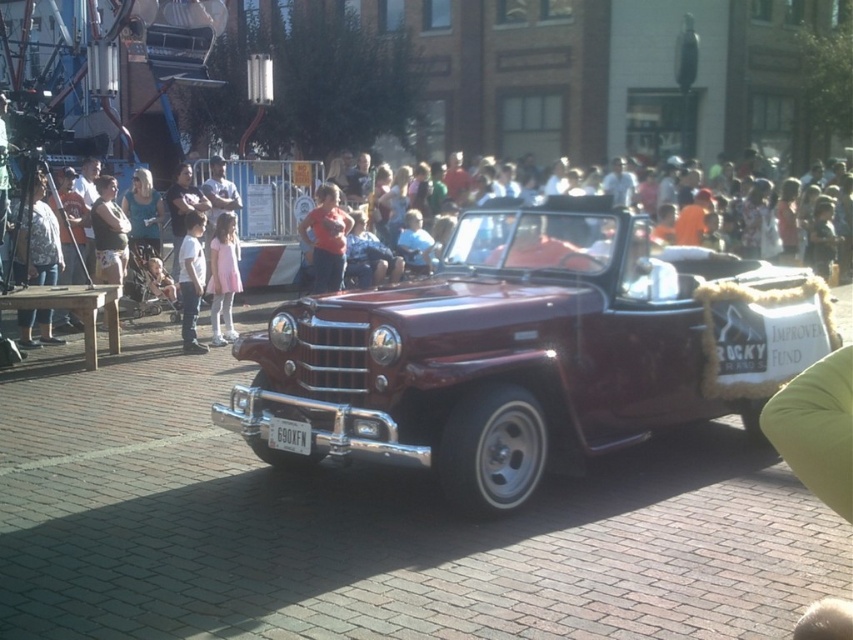
Question: Which point is closer to the camera?

Choices:
 (A) (254, 264)
 (B) (236, 333)

Answer: (B)

Question: Which object is positioned farthest from the white cotton shirt at left?

Choices:
 (A) pink satin dress at center
 (B) matte pink dress at left

Answer: (B)

Question: Among these objects, which one is farthest from the camera?

Choices:
 (A) pink satin dress at center
 (B) shiny maroon convertible at center
 (C) matte red shirt at center

Answer: (C)

Question: From the image, what is the correct spatial relationship of shiny maroon convertible at center in relation to white cotton shirt at left?

Choices:
 (A) left
 (B) right

Answer: (B)

Question: Is shiny maroon convertible at center to the left of white cotton shirt at left from the viewer's perspective?

Choices:
 (A) no
 (B) yes

Answer: (A)

Question: Can you confirm if matte pink dress at left is positioned to the left of pink satin dress at center?

Choices:
 (A) yes
 (B) no

Answer: (B)